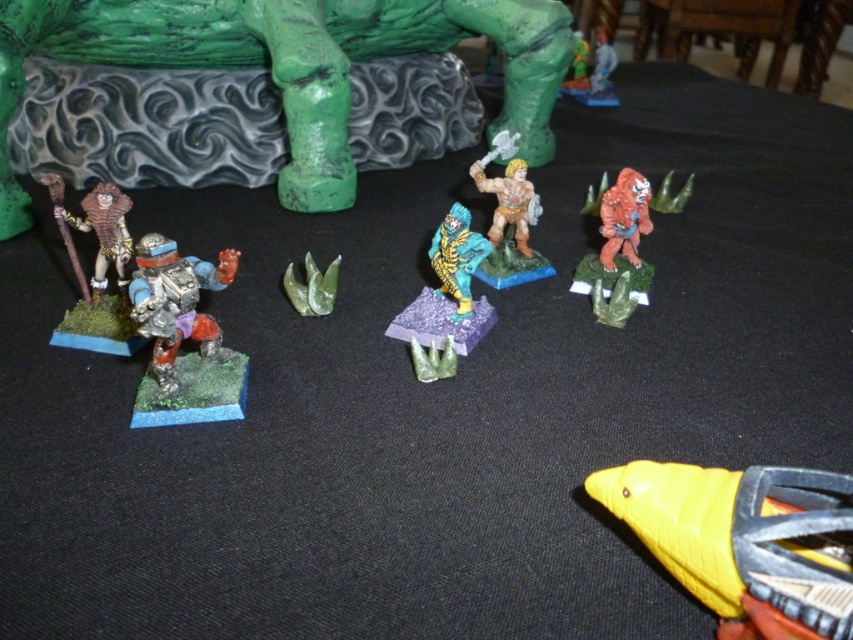
Question: Is brown matte figure at left smaller than green matte figure at upper center?

Choices:
 (A) yes
 (B) no

Answer: (A)

Question: Which object is farther from the camera taking this photo?

Choices:
 (A) yellow matte bird at center
 (B) brushed metal statue at upper left
 (C) teal matte figure at center
 (D) matte plastic figure at center

Answer: (D)

Question: Estimate the real-world distances between objects in this image. Which object is farther from the matte plastic figure at center?

Choices:
 (A) brushed metal statue at upper left
 (B) shiny silver armor at left

Answer: (B)

Question: Which object is positioned closest to the matte plastic figure at center?

Choices:
 (A) brushed metal statue at upper left
 (B) metallic silver sword at upper right
 (C) teal matte figure at center

Answer: (C)

Question: Can you confirm if matte orange figure at center is positioned to the left of matte orange fur at right?

Choices:
 (A) yes
 (B) no

Answer: (A)

Question: Considering the relative positions of yellow matte bird at center and matte orange fur at right in the image provided, where is yellow matte bird at center located with respect to matte orange fur at right?

Choices:
 (A) above
 (B) below

Answer: (B)